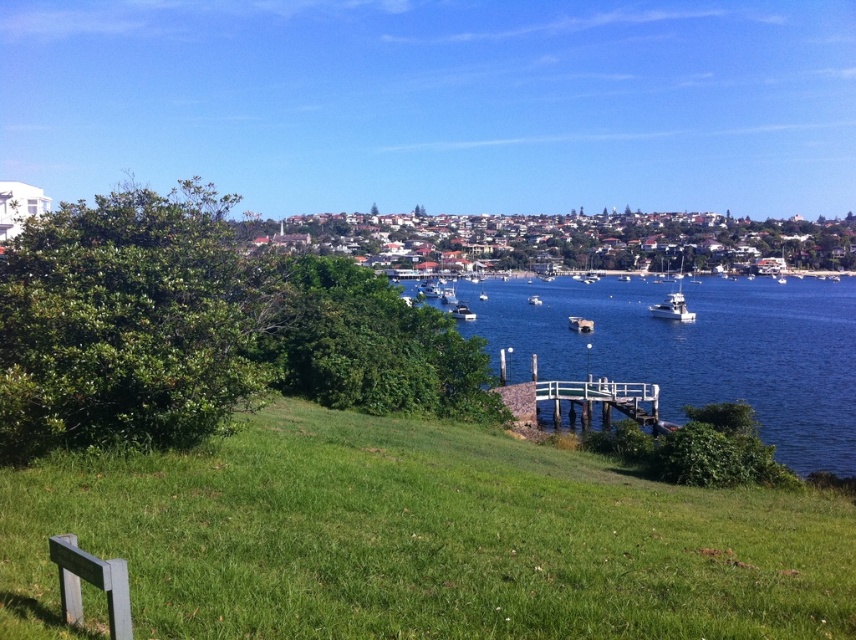
Question: Does blue wooden dock at lower center come in front of white glossy boat at right?

Choices:
 (A) no
 (B) yes

Answer: (B)

Question: Is green grassy at lower center smaller than blue wooden dock at lower center?

Choices:
 (A) no
 (B) yes

Answer: (B)

Question: Which point is closer to the camera?

Choices:
 (A) click(x=681, y=300)
 (B) click(x=752, y=348)
 (C) click(x=455, y=301)

Answer: (B)

Question: Does white glossy boat at right have a larger size compared to white glossy boat at center?

Choices:
 (A) yes
 (B) no

Answer: (A)

Question: Which point appears closest to the camera in this image?

Choices:
 (A) (467, 310)
 (B) (248, 532)
 (C) (586, 392)

Answer: (B)

Question: Which point is closer to the camera?

Choices:
 (A) green grassy at lower center
 (B) white glossy boat at center
 (C) blue wooden dock at lower center

Answer: (A)